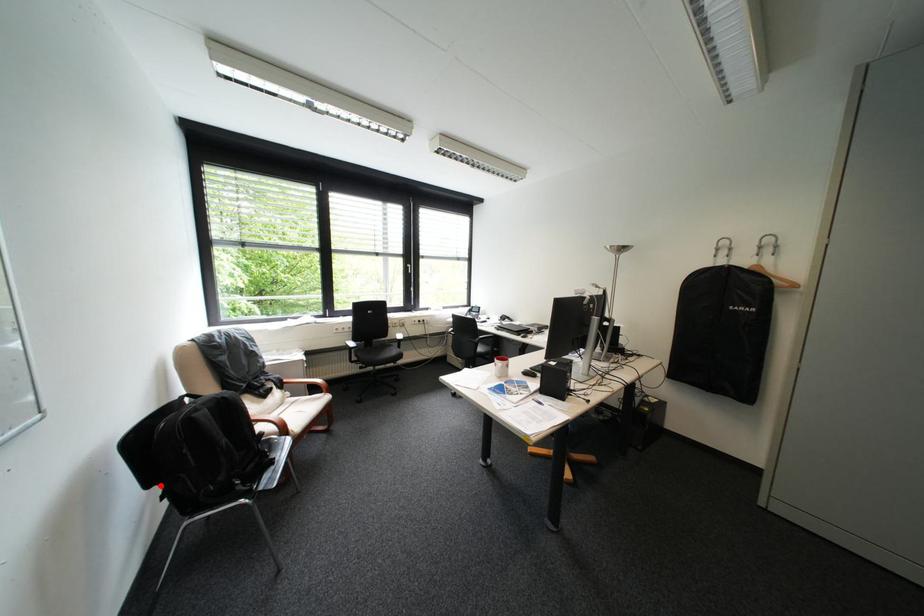
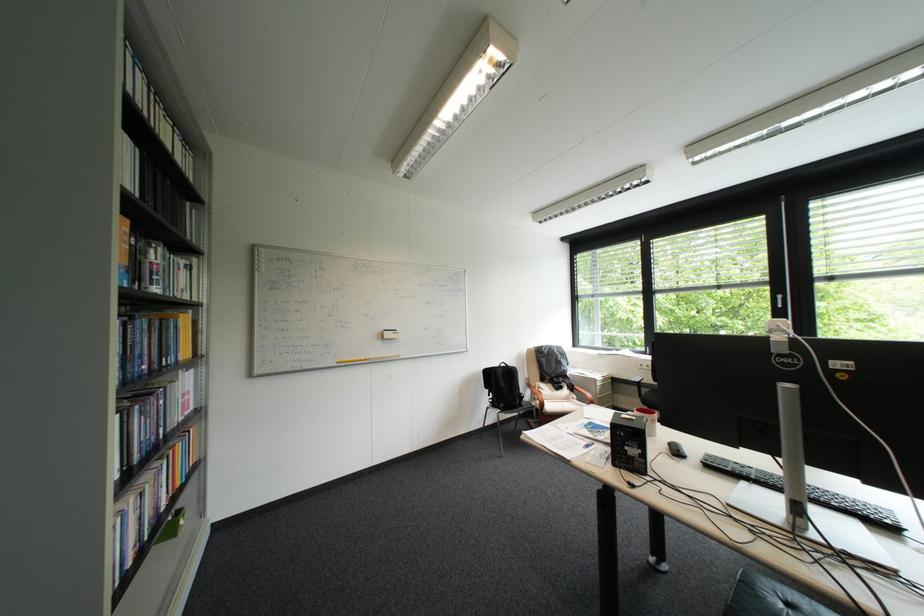
Question: I am providing you with two images of the same scene from different viewpoints. A red point is marked on the first image. Can you still see the location of the red point in image 2?

Choices:
 (A) Yes
 (B) No

Answer: (A)